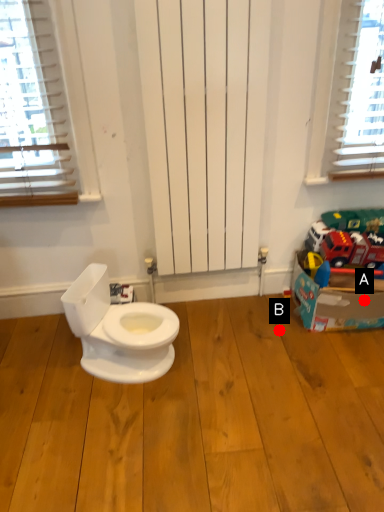
Question: Two points are circled on the image, labeled by A and B beside each circle. Among these points, which one is farthest from the camera?

Choices:
 (A) A is further
 (B) B is further

Answer: (B)